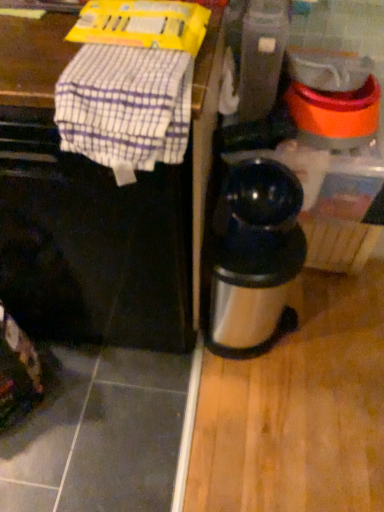
Question: From the image's perspective, is stainless steel thermos at right over metallic gray blender at center?

Choices:
 (A) no
 (B) yes

Answer: (A)

Question: Is the position of stainless steel thermos at right less distant than that of metallic gray blender at center?

Choices:
 (A) yes
 (B) no

Answer: (B)

Question: From the image's perspective, is stainless steel thermos at right beneath metallic gray blender at center?

Choices:
 (A) yes
 (B) no

Answer: (A)

Question: Can you confirm if stainless steel thermos at right is thinner than metallic gray blender at center?

Choices:
 (A) yes
 (B) no

Answer: (B)

Question: From a real-world perspective, is stainless steel thermos at right physically above metallic gray blender at center?

Choices:
 (A) no
 (B) yes

Answer: (A)

Question: Based on their positions, is metallic gray blender at center located to the left or right of white checkered cloth at upper left?

Choices:
 (A) left
 (B) right

Answer: (B)

Question: From a real-world perspective, is metallic gray blender at center physically located above or below white checkered cloth at upper left?

Choices:
 (A) above
 (B) below

Answer: (B)

Question: From the image's perspective, is metallic gray blender at center located above or below white checkered cloth at upper left?

Choices:
 (A) below
 (B) above

Answer: (B)

Question: Looking at the image, does metallic gray blender at center seem bigger or smaller compared to white checkered cloth at upper left?

Choices:
 (A) small
 (B) big

Answer: (B)

Question: Considering their positions, is stainless steel thermos at right located in front of or behind black matte coffee maker at center?

Choices:
 (A) behind
 (B) front

Answer: (A)

Question: Considering the positions of stainless steel thermos at right and black matte coffee maker at center in the image, is stainless steel thermos at right wider or thinner than black matte coffee maker at center?

Choices:
 (A) wide
 (B) thin

Answer: (B)

Question: Which is correct: stainless steel thermos at right is inside black matte coffee maker at center, or outside of it?

Choices:
 (A) inside
 (B) outside

Answer: (B)

Question: From the image's perspective, is stainless steel thermos at right positioned above or below black matte coffee maker at center?

Choices:
 (A) below
 (B) above

Answer: (A)

Question: From a real-world perspective, is white checkered cloth at upper left above or below black matte coffee maker at center?

Choices:
 (A) above
 (B) below

Answer: (A)

Question: Relative to black matte coffee maker at center, is white checkered cloth at upper left in front or behind?

Choices:
 (A) front
 (B) behind

Answer: (A)